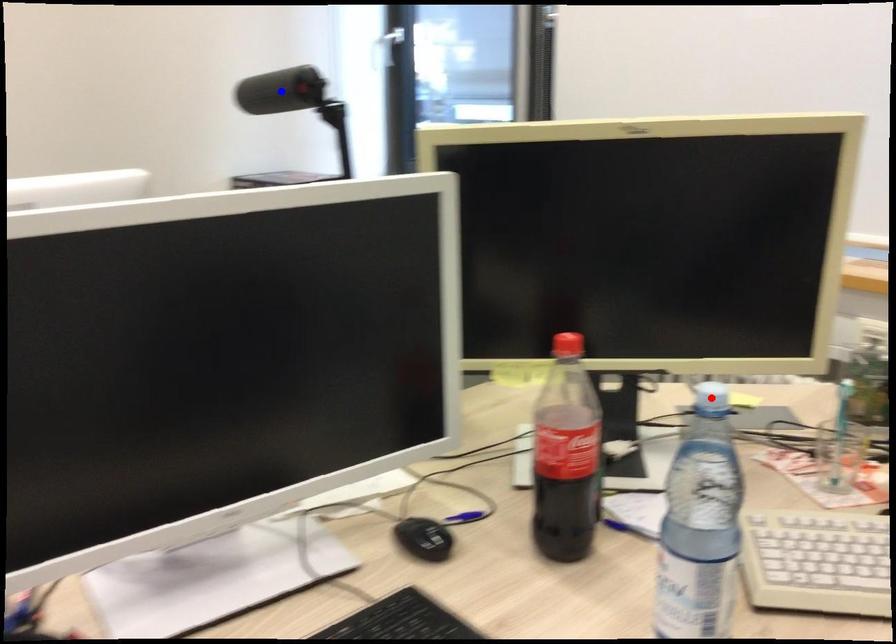
Question: In the image, two points are highlighted. Which point is nearer to the camera? Reply with the corresponding letter.

Choices:
 (A) blue point
 (B) red point

Answer: (B)